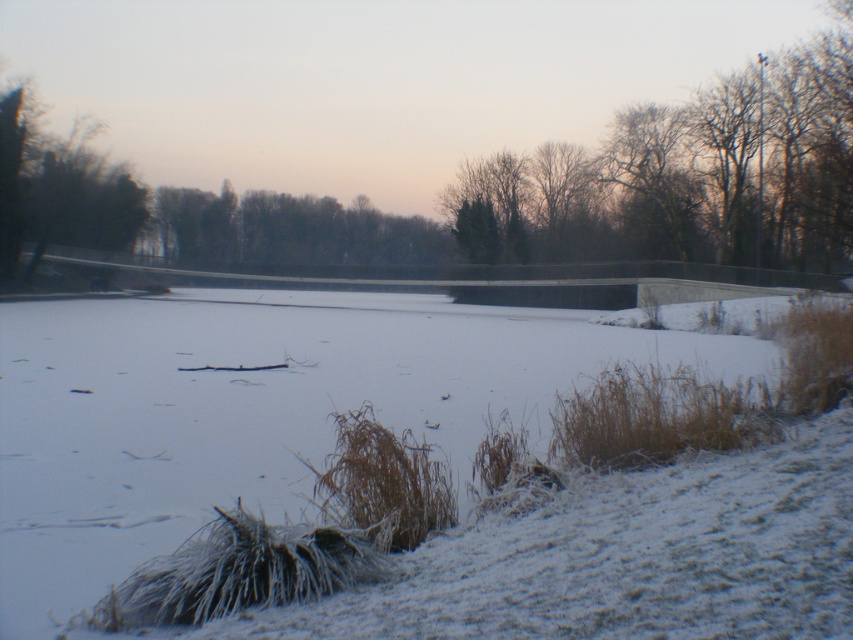
Question: Is green leafy trees at center below green leafy tree at left?

Choices:
 (A) yes
 (B) no

Answer: (A)

Question: Is bare branches at upper center wider than green leafy tree at left?

Choices:
 (A) yes
 (B) no

Answer: (A)

Question: Estimate the real-world distances between objects in this image. Which object is farther from the green leafy tree at left?

Choices:
 (A) green leafy trees at center
 (B) bare branches at upper center

Answer: (B)

Question: Which object is farther from the camera taking this photo?

Choices:
 (A) green leafy trees at center
 (B) green leafy tree at left

Answer: (A)

Question: Which object is positioned farthest from the bare branches at upper center?

Choices:
 (A) green leafy tree at left
 (B) green leafy trees at center

Answer: (A)

Question: Can you confirm if bare branches at upper center is positioned below green leafy tree at left?

Choices:
 (A) no
 (B) yes

Answer: (A)